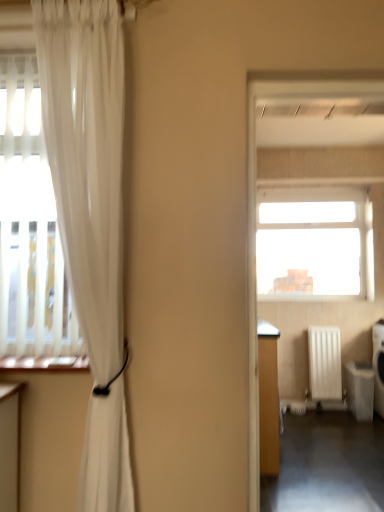
Identify the location of white matte radiator at right. The height and width of the screenshot is (512, 384). (325, 362).

What do you see at coordinates (325, 362) in the screenshot? I see `white matte radiator at right` at bounding box center [325, 362].

What are the coordinates of `white plastic dishwasher at lower right` in the screenshot? It's located at (360, 389).

Considering the relative sizes of white plastic dishwasher at lower right and translucent white curtain at left in the image provided, is white plastic dishwasher at lower right wider than translucent white curtain at left?

Yes, white plastic dishwasher at lower right is wider than translucent white curtain at left.

Who is bigger, white plastic dishwasher at lower right or translucent white curtain at left?

translucent white curtain at left is bigger.

Is white plastic dishwasher at lower right oriented towards translucent white curtain at left?

No, white plastic dishwasher at lower right is not oriented towards translucent white curtain at left.

From the image's perspective, which object appears higher, transparent glass window at upper center or dark gray concrete corridor at lower right?

transparent glass window at upper center, from the image's perspective.

Is transparent glass window at upper center shorter than dark gray concrete corridor at lower right?

In fact, transparent glass window at upper center may be taller than dark gray concrete corridor at lower right.

Considering the sizes of objects transparent glass window at upper center and dark gray concrete corridor at lower right in the image provided, who is thinner, transparent glass window at upper center or dark gray concrete corridor at lower right?

transparent glass window at upper center is thinner.

Consider the image. Does transparent glass window at upper center appear on the right side of dark gray concrete corridor at lower right?

Yes, transparent glass window at upper center is to the right of dark gray concrete corridor at lower right.

From a real-world perspective, is dark gray concrete corridor at lower right below white matte radiator at right?

Yes, from a real-world perspective, dark gray concrete corridor at lower right is beneath white matte radiator at right.

Which is in front, dark gray concrete corridor at lower right or white matte radiator at right?

dark gray concrete corridor at lower right is closer to the camera.

Is dark gray concrete corridor at lower right touching white matte radiator at right?

dark gray concrete corridor at lower right and white matte radiator at right are clearly separated.

Can you confirm if transparent glass window at upper center is positioned to the left of translucent white curtain at left?

No, transparent glass window at upper center is not to the left of translucent white curtain at left.

Based on their sizes in the image, would you say transparent glass window at upper center is bigger or smaller than translucent white curtain at left?

Clearly, transparent glass window at upper center is smaller in size than translucent white curtain at left.

You are a GUI agent. You are given a task and a screenshot of the screen. Output one action in this format:
    pyautogui.click(x=<x>, y=<y>)
    Task: Click on the curtain that appears below the transparent glass window at upper center (from a real-world perspective)
    This screenshot has width=384, height=512.
    Given the screenshot: What is the action you would take?
    pyautogui.click(x=91, y=217)

Can you confirm if transparent glass window at upper center is shorter than translucent white curtain at left?

Correct, transparent glass window at upper center is not as tall as translucent white curtain at left.

From a real-world perspective, is transparent glass window at upper center physically below white plastic dishwasher at lower right?

Incorrect, from a real-world perspective, transparent glass window at upper center is higher than white plastic dishwasher at lower right.

Consider the image. Considering the relative sizes of transparent glass window at upper center and white plastic dishwasher at lower right in the image provided, is transparent glass window at upper center smaller than white plastic dishwasher at lower right?

Actually, transparent glass window at upper center might be larger than white plastic dishwasher at lower right.

In the scene shown: Between transparent glass window at upper center and white plastic dishwasher at lower right, which one has more height?

transparent glass window at upper center is taller.

Is dark gray concrete corridor at lower right facing towards white plastic dishwasher at lower right?

No, dark gray concrete corridor at lower right is not oriented towards white plastic dishwasher at lower right.

From a real-world perspective, is dark gray concrete corridor at lower right located higher than white plastic dishwasher at lower right?

Incorrect, from a real-world perspective, dark gray concrete corridor at lower right is lower than white plastic dishwasher at lower right.

From the image's perspective, relative to white plastic dishwasher at lower right, is dark gray concrete corridor at lower right above or below?

dark gray concrete corridor at lower right is below white plastic dishwasher at lower right.

Is dark gray concrete corridor at lower right in front of or behind white plastic dishwasher at lower right in the image?

Visually, dark gray concrete corridor at lower right is located in front of white plastic dishwasher at lower right.

Is transparent glass window at upper center at the back of translucent white curtain at left?

That's not correct — translucent white curtain at left is not looking away from transparent glass window at upper center.

From the image's perspective, which is below, translucent white curtain at left or transparent glass window at upper center?

translucent white curtain at left, from the image's perspective.

Is translucent white curtain at left taller or shorter than transparent glass window at upper center?

In the image, translucent white curtain at left appears to be taller than transparent glass window at upper center.

Is transparent glass window at upper center located within translucent white curtain at left?

No, transparent glass window at upper center is not surrounded by translucent white curtain at left.

This screenshot has width=384, height=512. What are the coordinates of `dish washer to the right of translucent white curtain at left` in the screenshot? It's located at (360, 389).

At what (x,y) coordinates should I click in order to perform the action: click on window located behind the dark gray concrete corridor at lower right. Please return your answer as a coordinate pair (x, y). This screenshot has width=384, height=512. Looking at the image, I should click on (314, 244).

Estimate the real-world distances between objects in this image. Which object is further from translucent white curtain at left, dark gray concrete corridor at lower right or white matte radiator at right?

white matte radiator at right.

When comparing their distances from dark gray concrete corridor at lower right, does transparent glass window at upper center or white matte radiator at right seem closer?

white matte radiator at right is closer to dark gray concrete corridor at lower right.

Considering their positions, is dark gray concrete corridor at lower right positioned closer to white matte radiator at right than transparent glass window at upper center?

Among the two, transparent glass window at upper center is located nearer to white matte radiator at right.

Which object lies further to the anchor point white plastic dishwasher at lower right, dark gray concrete corridor at lower right or white matte radiator at right?

dark gray concrete corridor at lower right lies further to white plastic dishwasher at lower right than the other object.

Which object lies nearer to the anchor point translucent white curtain at left, white matte radiator at right or transparent glass window at upper center?

white matte radiator at right is positioned closer to the anchor translucent white curtain at left.

From the image, which object appears to be farther from white matte radiator at right, white plastic dishwasher at lower right or transparent glass window at upper center?

Based on the image, transparent glass window at upper center appears to be further to white matte radiator at right.

From the image, which object appears to be farther from translucent white curtain at left, transparent glass window at upper center or dark gray concrete corridor at lower right?

transparent glass window at upper center lies further to translucent white curtain at left than the other object.

Considering their positions, is dark gray concrete corridor at lower right positioned closer to transparent glass window at upper center than translucent white curtain at left?

dark gray concrete corridor at lower right lies closer to transparent glass window at upper center than the other object.

At what (x,y) coordinates should I click in order to perform the action: click on corridor between translucent white curtain at left and transparent glass window at upper center in the front-back direction. Please return your answer as a coordinate pair (x, y). Looking at the image, I should click on (327, 465).

Where is `radiator that lies between transparent glass window at upper center and white plastic dishwasher at lower right from top to bottom`? This screenshot has width=384, height=512. radiator that lies between transparent glass window at upper center and white plastic dishwasher at lower right from top to bottom is located at coordinates (325, 362).

Locate an element on the screen. This screenshot has width=384, height=512. dish washer between dark gray concrete corridor at lower right and transparent glass window at upper center in the front-back direction is located at coordinates (360, 389).

I want to click on corridor between translucent white curtain at left and white plastic dishwasher at lower right from front to back, so coord(327,465).